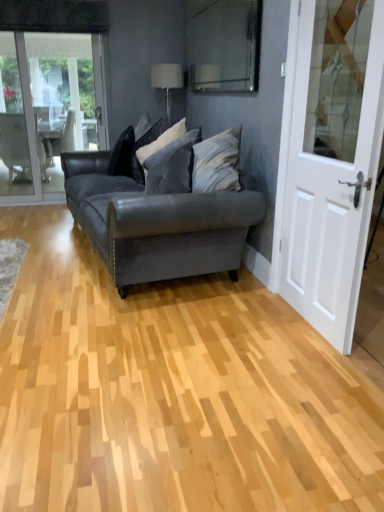
Question: Considering the relative positions of velvet gray pillow at center, which is counted as the first pillow, starting from the right, and matte black couch at center in the image provided, is velvet gray pillow at center, which is counted as the first pillow, starting from the right, to the left or to the right of matte black couch at center?

Choices:
 (A) left
 (B) right

Answer: (B)

Question: Considering the positions of velvet gray pillow at center, the 3th pillow viewed from the left, and matte black couch at center in the image, is velvet gray pillow at center, the 3th pillow viewed from the left, wider or thinner than matte black couch at center?

Choices:
 (A) thin
 (B) wide

Answer: (A)

Question: Estimate the real-world distances between objects in this image. Which object is closer to the transparent glass window screen at upper center?

Choices:
 (A) white wooden door at right
 (B) white fabric lampshade at upper center
 (C) velvet black pillow at center, which is the second pillow from left to right
 (D) velvet black pillow at center, the 3th pillow when ordered from right to left
 (E) velvet gray pillow at center, which is counted as the first pillow, starting from the right

Answer: (B)

Question: Which is nearer to the white wooden door at right?

Choices:
 (A) velvet black pillow at center, which is the second pillow from left to right
 (B) white fabric lampshade at upper center
 (C) transparent glass window screen at upper center
 (D) velvet gray pillow at center, which is counted as the first pillow, starting from the right
 (E) velvet black pillow at center, the 3th pillow when ordered from right to left

Answer: (D)